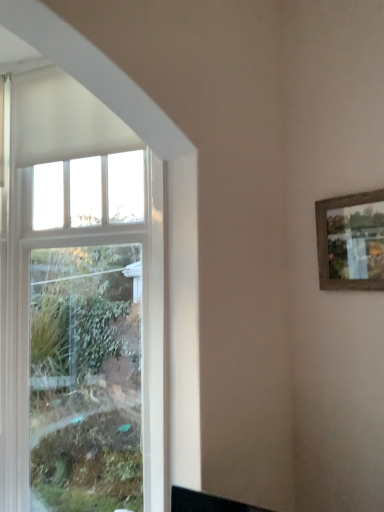
Find the location of a particular element. This screenshot has height=512, width=384. wooden-framed picture at upper right is located at coordinates (351, 242).

What do you see at coordinates (351, 242) in the screenshot?
I see `wooden-framed picture at upper right` at bounding box center [351, 242].

Measure the distance between point (96, 131) and camera.

6.32 feet.

What do you see at coordinates (79, 305) in the screenshot?
I see `white glass window at left` at bounding box center [79, 305].

Where is `white glass window at left`? This screenshot has height=512, width=384. white glass window at left is located at coordinates (79, 305).

Locate an element on the screen. wooden-framed picture at upper right is located at coordinates (351, 242).

Which is more to the left, white glass window at left or wooden-framed picture at upper right?

From the viewer's perspective, white glass window at left appears more on the left side.

Is white glass window at left in front of wooden-framed picture at upper right?

No, it is not.

Is point (15, 272) positioned after point (374, 257)?

Yes, it is.

From the image's perspective, is white glass window at left located beneath wooden-framed picture at upper right?

Yes, from the image's perspective, white glass window at left is beneath wooden-framed picture at upper right.

From a real-world perspective, is white glass window at left below wooden-framed picture at upper right?

Yes, from a real-world perspective, white glass window at left is beneath wooden-framed picture at upper right.

Which object is thinner, white glass window at left or wooden-framed picture at upper right?

wooden-framed picture at upper right.

Can you confirm if white glass window at left is taller than wooden-framed picture at upper right?

Indeed, white glass window at left has a greater height compared to wooden-framed picture at upper right.

Does white glass window at left have a larger size compared to wooden-framed picture at upper right?

Indeed, white glass window at left has a larger size compared to wooden-framed picture at upper right.

Would you say white glass window at left is outside wooden-framed picture at upper right?

That's correct, white glass window at left is outside of wooden-framed picture at upper right.

Is white glass window at left placed right next to wooden-framed picture at upper right?

They are not placed beside each other.

Is white glass window at left oriented away from wooden-framed picture at upper right?

No, white glass window at left is not facing the opposite direction of wooden-framed picture at upper right.

Where is `picture frame in front of the white glass window at left`? The width and height of the screenshot is (384, 512). picture frame in front of the white glass window at left is located at coordinates pyautogui.click(x=351, y=242).

Which object is positioned more to the right, wooden-framed picture at upper right or white glass window at left?

wooden-framed picture at upper right is more to the right.

Considering their positions, is wooden-framed picture at upper right located in front of or behind white glass window at left?

Result: In the image, wooden-framed picture at upper right appears in front of white glass window at left.

Does point (333, 266) lie in front of point (13, 269)?

Yes, it is.

From the image's perspective, which one is positioned higher, wooden-framed picture at upper right or white glass window at left?

From the image's view, wooden-framed picture at upper right is above.

From a real-world perspective, between wooden-framed picture at upper right and white glass window at left, who is vertically higher?

wooden-framed picture at upper right.

In terms of width, does wooden-framed picture at upper right look wider or thinner when compared to white glass window at left?

wooden-framed picture at upper right is thinner than white glass window at left.

In terms of height, does wooden-framed picture at upper right look taller or shorter compared to white glass window at left?

In the image, wooden-framed picture at upper right appears to be shorter than white glass window at left.

Looking at the image, does wooden-framed picture at upper right seem bigger or smaller compared to white glass window at left?

Considering their sizes, wooden-framed picture at upper right takes up less space than white glass window at left.

Is wooden-framed picture at upper right spatially inside white glass window at left, or outside of it?

wooden-framed picture at upper right is spatially situated outside white glass window at left.

Is wooden-framed picture at upper right in contact with white glass window at left?

wooden-framed picture at upper right is not next to white glass window at left, and they're not touching.

Is wooden-framed picture at upper right oriented away from white glass window at left?

wooden-framed picture at upper right does not have its back to white glass window at left.

How different are the orientations of wooden-framed picture at upper right and white glass window at left in degrees?

They differ by 31 degrees in their facing directions.

Locate an element on the screen. window below the wooden-framed picture at upper right (from the image's perspective) is located at coordinates (79, 305).

Identify the location of window that appears behind the wooden-framed picture at upper right. (79, 305).

At what (x,y) coordinates should I click in order to perform the action: click on picture frame in front of the white glass window at left. Please return your answer as a coordinate pair (x, y). The image size is (384, 512). Looking at the image, I should click on (351, 242).